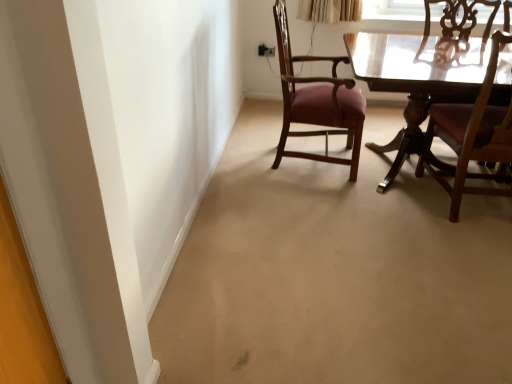
The width and height of the screenshot is (512, 384). What do you see at coordinates (317, 101) in the screenshot?
I see `purple upholstered chair at center, the 2th chair from the right` at bounding box center [317, 101].

Find the location of a particular element. The width and height of the screenshot is (512, 384). purple upholstered chair at center, which is counted as the first chair, starting from the left is located at coordinates (317, 101).

What do you see at coordinates (472, 137) in the screenshot? I see `wooden chair at right, the second chair viewed from the left` at bounding box center [472, 137].

Where is `wooden chair at right, the second chair viewed from the left`? This screenshot has height=384, width=512. wooden chair at right, the second chair viewed from the left is located at coordinates (472, 137).

Find the location of `purple upholstered chair at center, which is counted as the first chair, starting from the left`. purple upholstered chair at center, which is counted as the first chair, starting from the left is located at coordinates (317, 101).

Which object is positioned more to the right, wooden chair at right, the second chair viewed from the left, or purple upholstered chair at center, the 2th chair from the right?

wooden chair at right, the second chair viewed from the left.

Is wooden chair at right, placed as the first chair when sorted from right to left, in front of purple upholstered chair at center, which is counted as the first chair, starting from the left?

Yes, it is in front of purple upholstered chair at center, which is counted as the first chair, starting from the left.

Which point is more forward, (454,114) or (281,65)?

The point (454,114) is closer to the camera.

From the image's perspective, between wooden chair at right, placed as the first chair when sorted from right to left, and purple upholstered chair at center, which is counted as the first chair, starting from the left, who is located below?

wooden chair at right, placed as the first chair when sorted from right to left, appears lower in the image.

From a real-world perspective, who is located higher, wooden chair at right, placed as the first chair when sorted from right to left, or purple upholstered chair at center, which is counted as the first chair, starting from the left?

wooden chair at right, placed as the first chair when sorted from right to left.

From the picture: Considering the sizes of wooden chair at right, the second chair viewed from the left, and purple upholstered chair at center, which is counted as the first chair, starting from the left, in the image, is wooden chair at right, the second chair viewed from the left, wider or thinner than purple upholstered chair at center, which is counted as the first chair, starting from the left,?

wooden chair at right, the second chair viewed from the left, is thinner than purple upholstered chair at center, which is counted as the first chair, starting from the left.

Considering the sizes of wooden chair at right, placed as the first chair when sorted from right to left, and purple upholstered chair at center, which is counted as the first chair, starting from the left, in the image, is wooden chair at right, placed as the first chair when sorted from right to left, taller or shorter than purple upholstered chair at center, which is counted as the first chair, starting from the left,?

Clearly, wooden chair at right, placed as the first chair when sorted from right to left, is shorter compared to purple upholstered chair at center, which is counted as the first chair, starting from the left.

Can you confirm if wooden chair at right, placed as the first chair when sorted from right to left, is bigger than purple upholstered chair at center, which is counted as the first chair, starting from the left?

Actually, wooden chair at right, placed as the first chair when sorted from right to left, might be smaller than purple upholstered chair at center, which is counted as the first chair, starting from the left.

Is wooden chair at right, the second chair viewed from the left, inside the boundaries of purple upholstered chair at center, the 2th chair from the right, or outside?

wooden chair at right, the second chair viewed from the left, is not enclosed by purple upholstered chair at center, the 2th chair from the right.

Is wooden chair at right, placed as the first chair when sorted from right to left, oriented away from purple upholstered chair at center, which is counted as the first chair, starting from the left?

No, purple upholstered chair at center, which is counted as the first chair, starting from the left, is not at the back of wooden chair at right, placed as the first chair when sorted from right to left.

How many degrees apart are the facing directions of wooden chair at right, placed as the first chair when sorted from right to left, and purple upholstered chair at center, the 2th chair from the right?

The angle between the facing direction of wooden chair at right, placed as the first chair when sorted from right to left, and the facing direction of purple upholstered chair at center, the 2th chair from the right, is 92.6 degrees.

At what (x,y) coordinates should I click in order to perform the action: click on chair located above the wooden chair at right, the second chair viewed from the left (from the image's perspective). Please return your answer as a coordinate pair (x, y). The width and height of the screenshot is (512, 384). Looking at the image, I should click on (317, 101).

Visually, is purple upholstered chair at center, the 2th chair from the right, positioned to the left or to the right of wooden chair at right, placed as the first chair when sorted from right to left?

purple upholstered chair at center, the 2th chair from the right, is positioned on wooden chair at right, placed as the first chair when sorted from right to left,'s left side.

Is purple upholstered chair at center, which is counted as the first chair, starting from the left, closer to camera compared to wooden chair at right, placed as the first chair when sorted from right to left?

No, purple upholstered chair at center, which is counted as the first chair, starting from the left, is further to the viewer.

Considering the points (322, 85) and (497, 116), which point is behind, point (322, 85) or point (497, 116)?

The point (322, 85) is more distant.

From the image's perspective, does purple upholstered chair at center, which is counted as the first chair, starting from the left, appear lower than wooden chair at right, the second chair viewed from the left?

No.

From a real-world perspective, is purple upholstered chair at center, which is counted as the first chair, starting from the left, located beneath wooden chair at right, the second chair viewed from the left?

Yes.

Is purple upholstered chair at center, the 2th chair from the right, thinner than wooden chair at right, placed as the first chair when sorted from right to left?

In fact, purple upholstered chair at center, the 2th chair from the right, might be wider than wooden chair at right, placed as the first chair when sorted from right to left.

Based on the photo, which of these two, purple upholstered chair at center, the 2th chair from the right, or wooden chair at right, the second chair viewed from the left, stands shorter?

wooden chair at right, the second chair viewed from the left.

Is purple upholstered chair at center, which is counted as the first chair, starting from the left, smaller than wooden chair at right, placed as the first chair when sorted from right to left?

Incorrect, purple upholstered chair at center, which is counted as the first chair, starting from the left, is not smaller in size than wooden chair at right, placed as the first chair when sorted from right to left.

Do you think purple upholstered chair at center, which is counted as the first chair, starting from the left, is within wooden chair at right, the second chair viewed from the left, or outside of it?

The correct answer is: outside.

Is purple upholstered chair at center, which is counted as the first chair, starting from the left, far from wooden chair at right, the second chair viewed from the left?

No, purple upholstered chair at center, which is counted as the first chair, starting from the left, is in close proximity to wooden chair at right, the second chair viewed from the left.

Is purple upholstered chair at center, the 2th chair from the right, oriented towards wooden chair at right, placed as the first chair when sorted from right to left?

Yes, purple upholstered chair at center, the 2th chair from the right, is oriented towards wooden chair at right, placed as the first chair when sorted from right to left.

What's the angular difference between purple upholstered chair at center, the 2th chair from the right, and wooden chair at right, placed as the first chair when sorted from right to left,'s facing directions?

92.6 degrees.

There is a purple upholstered chair at center, which is counted as the first chair, starting from the left. At what (x,y) coordinates should I click in order to perform the action: click on chair above it (from a real-world perspective). Please return your answer as a coordinate pair (x, y). Looking at the image, I should click on (472, 137).

Locate an element on the screen. The width and height of the screenshot is (512, 384). chair below the purple upholstered chair at center, which is counted as the first chair, starting from the left (from the image's perspective) is located at coordinates (472, 137).

Identify the location of chair on the left of wooden chair at right, placed as the first chair when sorted from right to left. (317, 101).